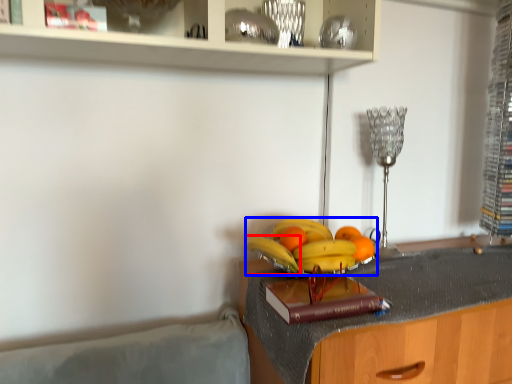
Question: Which of the following is the farthest to the observer, banana (highlighted by a red box) or banana (highlighted by a blue box)?

Choices:
 (A) banana
 (B) banana

Answer: (A)